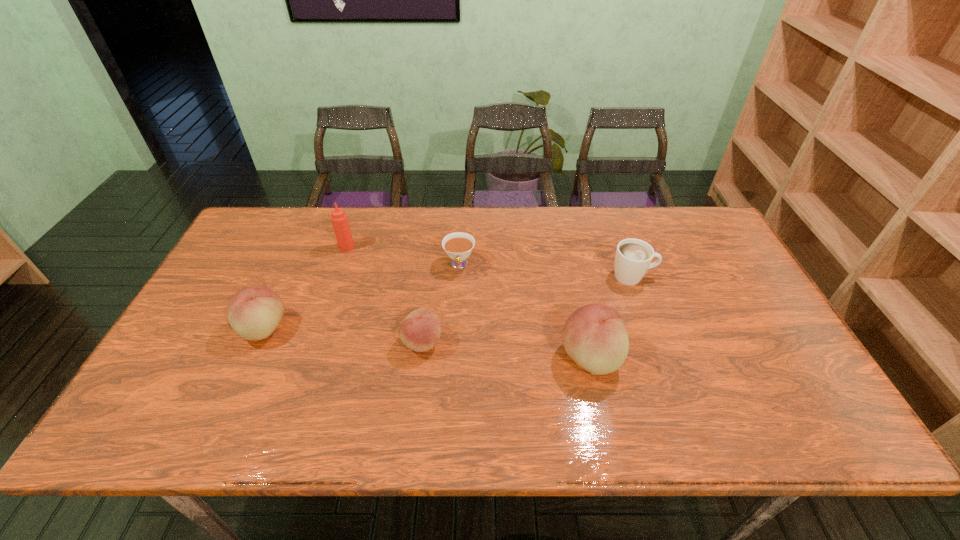
The peachs are evenly distributed in the image. To maintain this, where would you place another peach on the right? Please point to a free space. Please provide its 2D coordinates. Your answer should be formatted as a tuple, i.e. [(x, y)], where the tuple contains the x and y coordinates of a point satisfying the conditions above.

[(768, 373)]